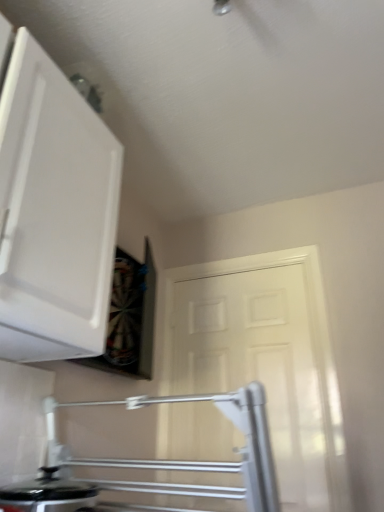
Question: Is white matte door at center directly adjacent to black glossy pot at lower left?

Choices:
 (A) no
 (B) yes

Answer: (A)

Question: Does white matte door at center have a lesser height compared to black glossy pot at lower left?

Choices:
 (A) yes
 (B) no

Answer: (B)

Question: Can you confirm if white matte door at center is positioned to the left of black glossy pot at lower left?

Choices:
 (A) yes
 (B) no

Answer: (B)

Question: From the image's perspective, is white matte door at center below black glossy pot at lower left?

Choices:
 (A) yes
 (B) no

Answer: (B)

Question: Considering the relative sizes of white matte door at center and black glossy pot at lower left in the image provided, is white matte door at center taller than black glossy pot at lower left?

Choices:
 (A) no
 (B) yes

Answer: (B)

Question: From a real-world perspective, is white matte door at center located higher than black glossy pot at lower left?

Choices:
 (A) no
 (B) yes

Answer: (B)

Question: Can you confirm if white matte cabinet at upper left is bigger than black glossy pot at lower left?

Choices:
 (A) no
 (B) yes

Answer: (B)

Question: Is white matte cabinet at upper left facing away from black glossy pot at lower left?

Choices:
 (A) no
 (B) yes

Answer: (A)

Question: Does white matte cabinet at upper left appear on the left side of black glossy pot at lower left?

Choices:
 (A) no
 (B) yes

Answer: (B)

Question: From a real-world perspective, is white matte cabinet at upper left positioned under black glossy pot at lower left based on gravity?

Choices:
 (A) no
 (B) yes

Answer: (A)

Question: Is the position of white matte cabinet at upper left more distant than that of black glossy pot at lower left?

Choices:
 (A) no
 (B) yes

Answer: (A)

Question: From a real-world perspective, is white matte cabinet at upper left positioned over black glossy pot at lower left based on gravity?

Choices:
 (A) yes
 (B) no

Answer: (A)

Question: Considering the relative sizes of black glossy pot at lower left and white matte cabinet at upper left in the image provided, is black glossy pot at lower left wider than white matte cabinet at upper left?

Choices:
 (A) no
 (B) yes

Answer: (A)